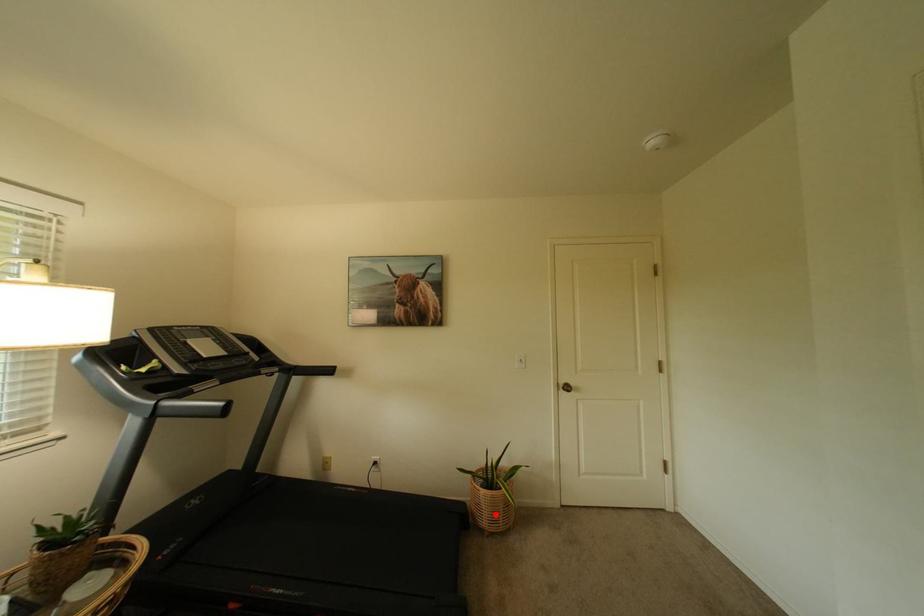
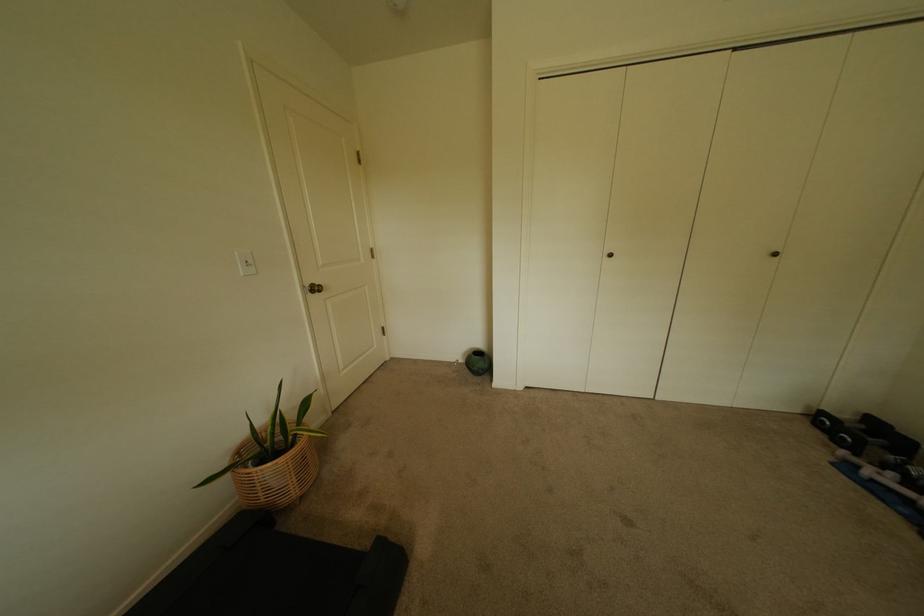
Where in the second image is the point corresponding to the highlighted location from the first image?

(302, 480)